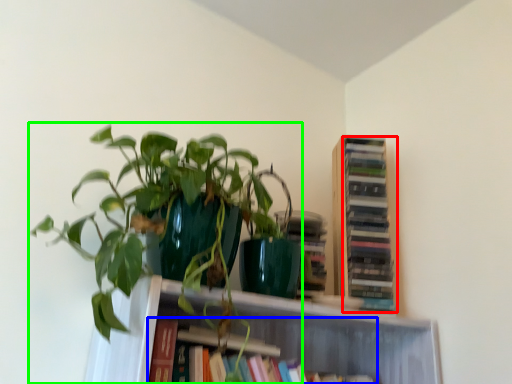
Question: Which object is positioned farthest from book (highlighted by a red box)? Select from book (highlighted by a blue box) and houseplant (highlighted by a green box).

Choices:
 (A) book
 (B) houseplant

Answer: (B)